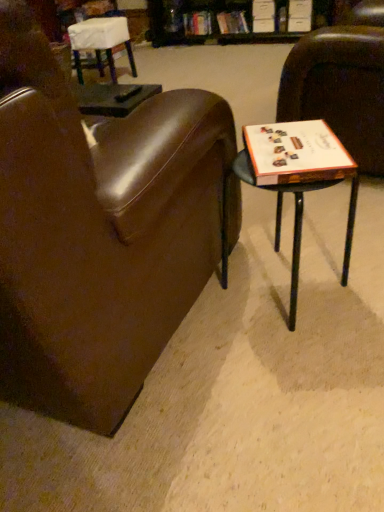
Locate an element on the screen. Image resolution: width=384 pixels, height=512 pixels. white paper at right is located at coordinates (296, 153).

You are a GUI agent. You are given a task and a screenshot of the screen. Output one action in this format:
    pyautogui.click(x=<x>, y=<y>)
    Task: Click on the wooden table at right
    
    Given the screenshot: What is the action you would take?
    pyautogui.click(x=298, y=178)

You are a GUI agent. You are given a task and a screenshot of the screen. Output one action in this format:
    pyautogui.click(x=<x>, y=<y>)
    Task: Click on the wooden bookshelf at upper center
    
    Given the screenshot: What is the action you would take?
    pyautogui.click(x=210, y=22)

What do you see at coordinates (210, 22) in the screenshot?
I see `wooden bookshelf at upper center` at bounding box center [210, 22].

Image resolution: width=384 pixels, height=512 pixels. What do you see at coordinates (197, 23) in the screenshot? I see `hardcover book at upper center, acting as the 2th book starting from the right` at bounding box center [197, 23].

The image size is (384, 512). I want to click on hardcover book at upper center, the 1th book in the left-to-right sequence, so click(x=197, y=23).

Identify the location of white paper at right. The height and width of the screenshot is (512, 384). (296, 153).

Does hardcover book at upper center, acting as the 2th book starting from the right, turn towards wooden bookshelf at upper center?

Yes, hardcover book at upper center, acting as the 2th book starting from the right, is aimed at wooden bookshelf at upper center.

Are hardcover book at upper center, acting as the 2th book starting from the right, and wooden bookshelf at upper center beside each other?

hardcover book at upper center, acting as the 2th book starting from the right, and wooden bookshelf at upper center are not in contact.

Looking at this image, from the image's perspective, which one is positioned lower, hardcover book at upper center, the 1th book in the left-to-right sequence, or wooden bookshelf at upper center?

From the image's view, wooden bookshelf at upper center is below.

Would you say hardcover book at upper center, the 1th book in the left-to-right sequence, is outside wooden bookshelf at upper center?

No, hardcover book at upper center, the 1th book in the left-to-right sequence, is inside wooden bookshelf at upper center's boundary.

Which of these two, hardcover book at upper center, acting as the 2th book starting from the right, or brown leather chair at right, which ranks as the second chair in front-to-back order, is bigger?

With larger size is brown leather chair at right, which ranks as the second chair in front-to-back order.

Is there a large distance between hardcover book at upper center, acting as the 2th book starting from the right, and brown leather chair at right, which ranks as the second chair in front-to-back order?

Indeed, hardcover book at upper center, acting as the 2th book starting from the right, is not near brown leather chair at right, which ranks as the second chair in front-to-back order.

From a real-world perspective, which is physically below, white fabric-covered chair at upper left, marked as the third chair in a right-to-left arrangement, or hardcover book at upper center, placed as the second book when sorted from left to right?

In real-world perspective, hardcover book at upper center, placed as the second book when sorted from left to right, is lower.

Looking at this image, from the image's perspective, which is below, white fabric-covered chair at upper left, positioned as the third chair in front-to-back order, or hardcover book at upper center, placed as the second book when sorted from left to right?

white fabric-covered chair at upper left, positioned as the third chair in front-to-back order, appears lower in the image.

Considering their positions, is white fabric-covered chair at upper left, positioned as the third chair in front-to-back order, located in front of or behind hardcover book at upper center, marked as the 1th book in a right-to-left arrangement?

Visually, white fabric-covered chair at upper left, positioned as the third chair in front-to-back order, is located in front of hardcover book at upper center, marked as the 1th book in a right-to-left arrangement.

Is brown leather chair at center, which ranks as the first chair in front-to-back order, aimed at hardcover book at upper center, the 1th book in the left-to-right sequence?

Yes, brown leather chair at center, which ranks as the first chair in front-to-back order, faces towards hardcover book at upper center, the 1th book in the left-to-right sequence.

From a real-world perspective, is brown leather chair at center, which ranks as the first chair in front-to-back order, physically above hardcover book at upper center, acting as the 2th book starting from the right?

Indeed, from a real-world perspective, brown leather chair at center, which ranks as the first chair in front-to-back order, stands above hardcover book at upper center, acting as the 2th book starting from the right.

Can you confirm if brown leather chair at center, which ranks as the third chair in back-to-front order, is wider than hardcover book at upper center, the 1th book in the left-to-right sequence?

Correct, the width of brown leather chair at center, which ranks as the third chair in back-to-front order, exceeds that of hardcover book at upper center, the 1th book in the left-to-right sequence.

Which is closer, (5,115) or (205,11)?

The point (5,115) is more forward.

Is the surface of hardcover book at upper center, placed as the second book when sorted from left to right, in direct contact with hardcover book at upper center, acting as the 2th book starting from the right?

No, hardcover book at upper center, placed as the second book when sorted from left to right, is not beside hardcover book at upper center, acting as the 2th book starting from the right.

From the image's perspective, which object appears higher, hardcover book at upper center, placed as the second book when sorted from left to right, or hardcover book at upper center, the 1th book in the left-to-right sequence?

hardcover book at upper center, the 1th book in the left-to-right sequence, is shown above in the image.

From their relative heights in the image, would you say hardcover book at upper center, marked as the 1th book in a right-to-left arrangement, is taller or shorter than hardcover book at upper center, the 1th book in the left-to-right sequence?

Clearly, hardcover book at upper center, marked as the 1th book in a right-to-left arrangement, is shorter compared to hardcover book at upper center, the 1th book in the left-to-right sequence.

From a real-world perspective, is hardcover book at upper center, placed as the second book when sorted from left to right, on top of hardcover book at upper center, the 1th book in the left-to-right sequence?

No.

Which is behind, point (201, 23) or point (268, 126)?

The point (201, 23) is farther from the camera.

There is a wooden table at right. At what (x,y) coordinates should I click in order to perform the action: click on the 2nd book above it (from the image's perspective). Please return your answer as a coordinate pair (x, y). Looking at the image, I should click on (197, 23).

Is hardcover book at upper center, acting as the 2th book starting from the right, smaller than wooden table at right?

Yes, hardcover book at upper center, acting as the 2th book starting from the right, is smaller than wooden table at right.

From the picture: From a real-world perspective, is hardcover book at upper center, the 1th book in the left-to-right sequence, located beneath wooden table at right?

Yes, from a real-world perspective, hardcover book at upper center, the 1th book in the left-to-right sequence, is below wooden table at right.

Could you tell me if hardcover book at upper center, the 1th book in the left-to-right sequence, is facing hardcover book at upper center, placed as the second book when sorted from left to right?

No, hardcover book at upper center, the 1th book in the left-to-right sequence, does not turn towards hardcover book at upper center, placed as the second book when sorted from left to right.

In the scene shown: Is hardcover book at upper center, the 1th book in the left-to-right sequence, with hardcover book at upper center, marked as the 1th book in a right-to-left arrangement?

No.

Is hardcover book at upper center, acting as the 2th book starting from the right, in front of hardcover book at upper center, placed as the second book when sorted from left to right?

That is False.

From a real-world perspective, is hardcover book at upper center, acting as the 2th book starting from the right, positioned over hardcover book at upper center, marked as the 1th book in a right-to-left arrangement, based on gravity?

Indeed, from a real-world perspective, hardcover book at upper center, acting as the 2th book starting from the right, stands above hardcover book at upper center, marked as the 1th book in a right-to-left arrangement.

Which book is the 2nd one when counting from the back of the wooden bookshelf at upper center? Please provide its 2D coordinates.

[(197, 23)]

Locate an element on the screen. The width and height of the screenshot is (384, 512). chair that is the 2nd one when counting downward from the hardcover book at upper center, acting as the 2th book starting from the right (from the image's perspective) is located at coordinates (339, 89).

When comparing their distances from brown leather chair at center, which ranks as the first chair in front-to-back order, does brown leather chair at right, the 3th chair positioned from the left, or hardcover book at upper center, marked as the 1th book in a right-to-left arrangement, seem further?

The object further to brown leather chair at center, which ranks as the first chair in front-to-back order, is hardcover book at upper center, marked as the 1th book in a right-to-left arrangement.

Considering their positions, is wooden table at right positioned closer to brown leather chair at right, which ranks as the second chair in front-to-back order, than hardcover book at upper center, acting as the 2th book starting from the right?

The object closer to brown leather chair at right, which ranks as the second chair in front-to-back order, is wooden table at right.

From the image, which object appears to be nearer to brown leather chair at right, the 3th chair positioned from the left, wooden table at right or wooden bookshelf at upper center?

The object closer to brown leather chair at right, the 3th chair positioned from the left, is wooden table at right.

When comparing their distances from white fabric-covered chair at upper left, positioned as the third chair in front-to-back order, does white paper at right or brown leather chair at right, the 3th chair positioned from the left, seem further?

white paper at right is further to white fabric-covered chair at upper left, positioned as the third chair in front-to-back order.

Looking at the image, which one is located closer to wooden table at right, brown leather chair at center, which appears as the second chair when viewed from the left, or hardcover book at upper center, marked as the 1th book in a right-to-left arrangement?

brown leather chair at center, which appears as the second chair when viewed from the left, is closer to wooden table at right.

From the image, which object appears to be farther from wooden table at right, brown leather chair at right, which ranks as the second chair in front-to-back order, or hardcover book at upper center, acting as the 2th book starting from the right?

hardcover book at upper center, acting as the 2th book starting from the right, is positioned further to the anchor wooden table at right.

From the image, which object appears to be nearer to hardcover book at upper center, marked as the 1th book in a right-to-left arrangement, hardcover book at upper center, the 1th book in the left-to-right sequence, or wooden table at right?

Among the two, hardcover book at upper center, the 1th book in the left-to-right sequence, is located nearer to hardcover book at upper center, marked as the 1th book in a right-to-left arrangement.

When comparing their distances from hardcover book at upper center, placed as the second book when sorted from left to right, does brown leather chair at right, the first chair in the right-to-left sequence, or brown leather chair at center, which ranks as the third chair in back-to-front order, seem closer?

brown leather chair at right, the first chair in the right-to-left sequence.

You are a GUI agent. You are given a task and a screenshot of the screen. Output one action in this format:
    pyautogui.click(x=<x>, y=<y>)
    Task: Click on the chair between brown leather chair at right, the 3th chair positioned from the left, and hardcover book at upper center, the 1th book in the left-to-right sequence, from front to back
    The height and width of the screenshot is (512, 384).
    Given the screenshot: What is the action you would take?
    pyautogui.click(x=101, y=42)

The width and height of the screenshot is (384, 512). I want to click on chair between wooden table at right and white fabric-covered chair at upper left, marked as the third chair in a right-to-left arrangement, in the front-back direction, so click(x=339, y=89).

The width and height of the screenshot is (384, 512). Identify the location of paperback book between brown leather chair at center, which is the 2th chair in right-to-left order, and hardcover book at upper center, acting as the 2th book starting from the right, along the z-axis. (296, 153).

Identify the location of book situated between white fabric-covered chair at upper left, the first chair positioned from the back, and hardcover book at upper center, marked as the 1th book in a right-to-left arrangement, from left to right. (197, 23).